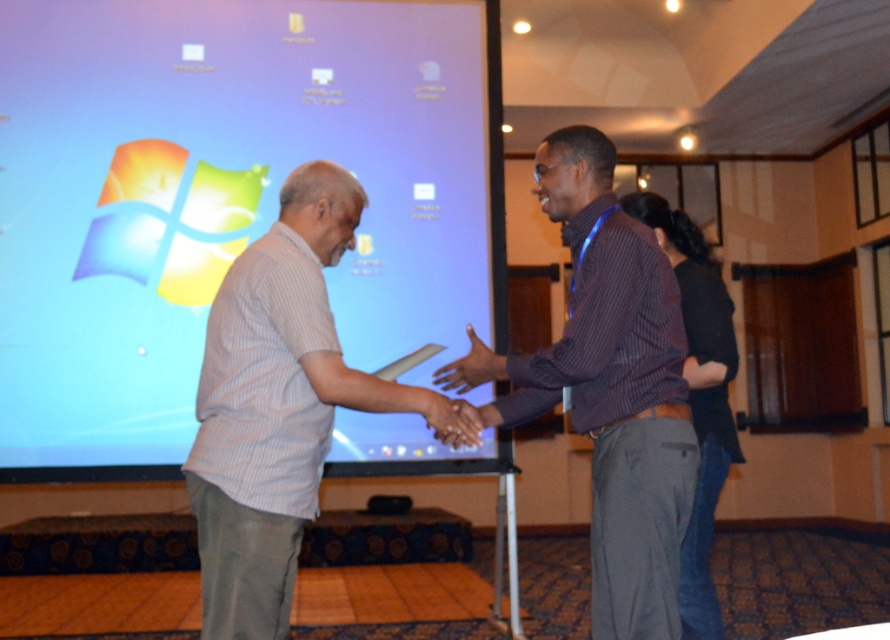
Is purple striped shirt at center positioned before smooth skin handshake at center?

Yes, it is in front of smooth skin handshake at center.

Can you confirm if purple striped shirt at center is positioned to the right of smooth skin handshake at center?

Yes, purple striped shirt at center is to the right of smooth skin handshake at center.

Who is more forward, (665,620) or (468,436)?

Point (665,620) is in front.

I want to click on purple striped shirt at center, so click(x=615, y=388).

Is matte black hand at center above smooth skin handshake at center?

Yes.

Does point (455, 365) come behind point (448, 401)?

Yes.

Identify the location of matte black hand at center. (471, 368).

Which is in front, point (312, 195) or point (445, 429)?

Point (445, 429) is in front.

Does white striped shirt at left have a larger size compared to smooth skin handshake at center?

Indeed, white striped shirt at left has a larger size compared to smooth skin handshake at center.

Describe the element at coordinates (274, 404) in the screenshot. I see `white striped shirt at left` at that location.

You are a GUI agent. You are given a task and a screenshot of the screen. Output one action in this format:
    pyautogui.click(x=<x>, y=<y>)
    Task: Click on the white striped shirt at left
    
    Given the screenshot: What is the action you would take?
    pyautogui.click(x=274, y=404)